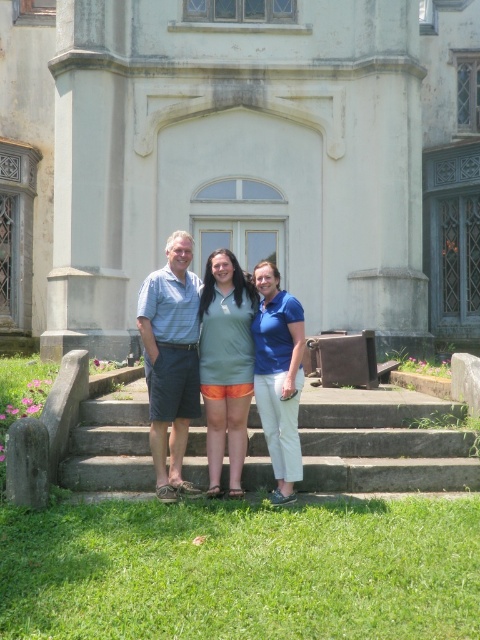
You are a photographer trying to decide where to place a new subject in the image. The new subject is wearing a navy blue dress that is slightly larger than the blue cotton polo shirt at center. Where should you place the navy blue dress to maintain visual balance with the light blue striped shirt at center?

The navy blue dress should be placed near the light blue striped shirt at center since it is larger than the blue cotton polo shirt at center, mirroring the size relationship between the existing shirts to maintain balance.

You are standing at the bottom of the gray concrete stairs at center and want to reach the blue cotton polo shirt at center. Which direction should you move?

You should move upward to reach the blue cotton polo shirt at center because the gray concrete stairs at center are located below it.

Looking at this image, you are a photographer trying to capture a group photo of the matte blue shirt at center and the green matte dress at center. Which one should you focus on first if you want to ensure both are in frame?

The matte blue shirt at center is positioned on the left side of green matte dress at center, so you should focus on the matte blue shirt at center first to ensure both are in frame.